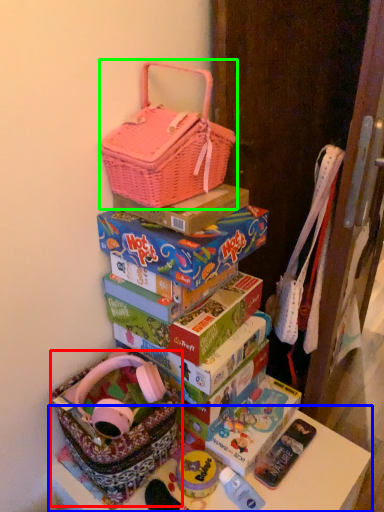
Question: Which object is positioned closest to gift basket (highlighted by a red box)? Select from table (highlighted by a blue box) and handbag (highlighted by a green box).

Choices:
 (A) table
 (B) handbag

Answer: (A)